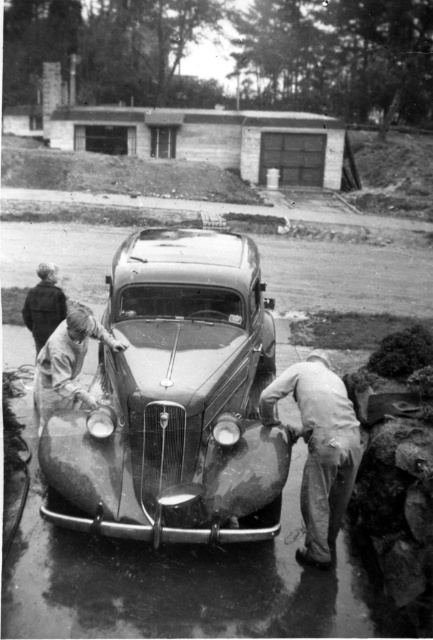
Which is more to the right, light gray fabric pants at lower right or dark brown leather jacket at upper left?

light gray fabric pants at lower right is more to the right.

Who is more distant from viewer, (352, 483) or (57, 316)?

Positioned behind is point (57, 316).

Who is more forward, (280, 380) or (38, 316)?

Point (280, 380)

Where is `light gray fabric pants at lower right`? Image resolution: width=433 pixels, height=640 pixels. light gray fabric pants at lower right is located at coordinates (319, 449).

Can you confirm if polished metal car at center is positioned below light brown leather jacket at front center?

Actually, polished metal car at center is above light brown leather jacket at front center.

Is polished metal car at center above light brown leather jacket at front center?

Yes.

What do you see at coordinates (175, 401) in the screenshot? The image size is (433, 640). I see `polished metal car at center` at bounding box center [175, 401].

Where is `polished metal car at center`? polished metal car at center is located at coordinates (175, 401).

Is light brown leather jacket at front center taller than dark brown leather jacket at upper left?

Indeed, light brown leather jacket at front center has a greater height compared to dark brown leather jacket at upper left.

Consider the image. Does light brown leather jacket at front center lie behind dark brown leather jacket at upper left?

No, it is in front of dark brown leather jacket at upper left.

Is point (67, 342) positioned before point (41, 316)?

Yes, point (67, 342) is closer to viewer.

Identify the location of light brown leather jacket at front center. (67, 364).